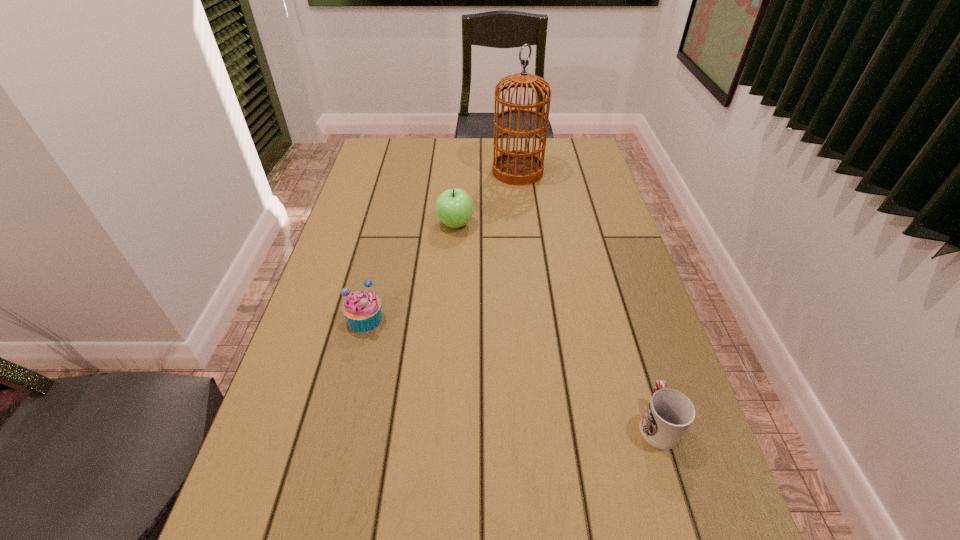
Find the location of a particular element. The width and height of the screenshot is (960, 540). blank region between the third object from left to right and the rightmost object is located at coordinates (588, 297).

Locate which object is the closest to the cup. Please provide its 2D coordinates. Your answer should be formatted as a tuple, i.e. [(x, y)], where the tuple contains the x and y coordinates of a point satisfying the conditions above.

[(362, 309)]

Identify which object is the second closest to the tallest object. Please provide its 2D coordinates. Your answer should be formatted as a tuple, i.e. [(x, y)], where the tuple contains the x and y coordinates of a point satisfying the conditions above.

[(362, 309)]

You are a GUI agent. You are given a task and a screenshot of the screen. Output one action in this format:
    pyautogui.click(x=<x>, y=<y>)
    Task: Click on the vacant space that satisfies the following two spatial constraints: 1. on the back side of the muffin; 2. on the left side of the second object from right to left
    This screenshot has width=960, height=540.
    Given the screenshot: What is the action you would take?
    pyautogui.click(x=401, y=172)

Where is `vacant space that satisfies the following two spatial constraints: 1. on the back side of the second farthest object; 2. on the right side of the muffin`? This screenshot has width=960, height=540. vacant space that satisfies the following two spatial constraints: 1. on the back side of the second farthest object; 2. on the right side of the muffin is located at coordinates (389, 224).

The width and height of the screenshot is (960, 540). I want to click on vacant space that satisfies the following two spatial constraints: 1. on the back side of the birdcage; 2. on the right side of the second farthest object, so click(x=459, y=172).